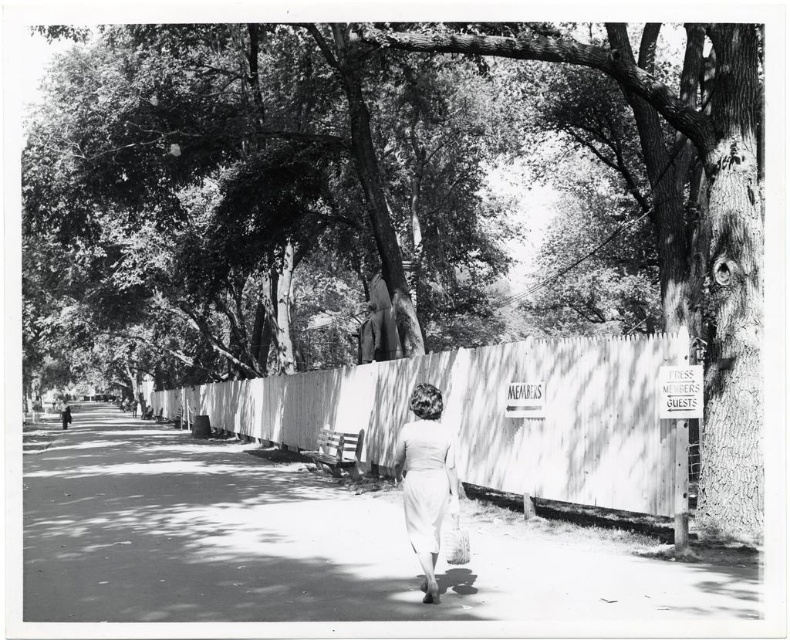
You are trying to decide which dress to wear to a formal event. Both the white satin dress at center and the white cotton dress at center are options. Based on their lengths, which one would be more appropriate for a formal setting?

The white satin dress at center is shorter than the white cotton dress at center, so the white cotton dress at center would be more appropriate for a formal setting as it is longer.

You are a photographer standing in the middle of the pathway. You notice the white wood fence at center and the white satin dress at center. Which object is positioned higher relative to the other?

The white wood fence at center is located above the white satin dress at center, so it is positioned higher.

You are standing at the starting point of the pathway in the park. You see two points marked on the signpost attached to the fence. The first point is at coordinates point (x=296, y=397) and the second is at point (x=441, y=426). If you want to reach the point that is further ahead along the pathway, which coordinate should you head towards?

Point (x=296, y=397) is behind point (x=441, y=426), so to reach the point further ahead along the pathway, you should head towards point (x=441, y=426).